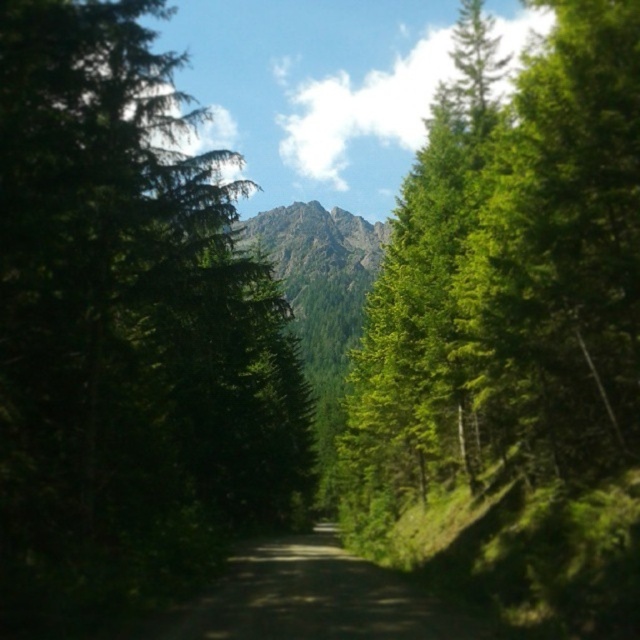
Which is more to the right, green matte tree at left or dirt road at center?

From the viewer's perspective, dirt road at center appears more on the right side.

Describe the element at coordinates (125, 332) in the screenshot. I see `green matte tree at left` at that location.

I want to click on green matte tree at left, so click(x=125, y=332).

Is the position of green leafy tree at center more distant than that of dirt road at center?

Yes, it is behind dirt road at center.

Is point (589, 147) more distant than point (170, 624)?

Yes, it is behind point (170, 624).

Does point (614, 99) come closer to viewer compared to point (328, 532)?

Yes, it is.

Locate an element on the screen. green leafy tree at center is located at coordinates (509, 284).

Who is more distant from viewer, (273, 525) or (340, 483)?

The point (340, 483) is behind.

Is point (208, 296) behind point (632, 301)?

Yes, it is.

Does point (77, 68) come farther from viewer compared to point (474, 401)?

No, (77, 68) is closer to viewer.

Where is `green matte tree at left`? This screenshot has width=640, height=640. green matte tree at left is located at coordinates (125, 332).